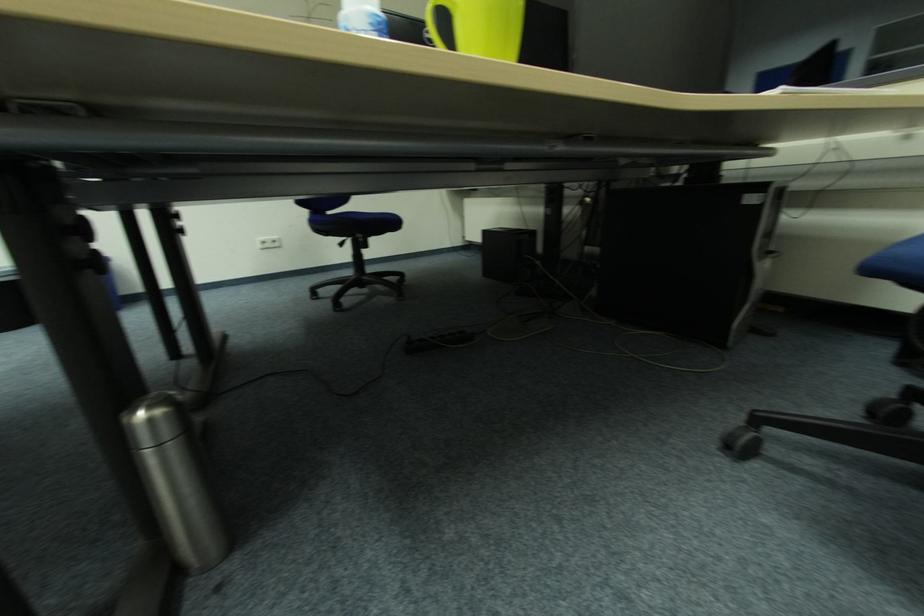
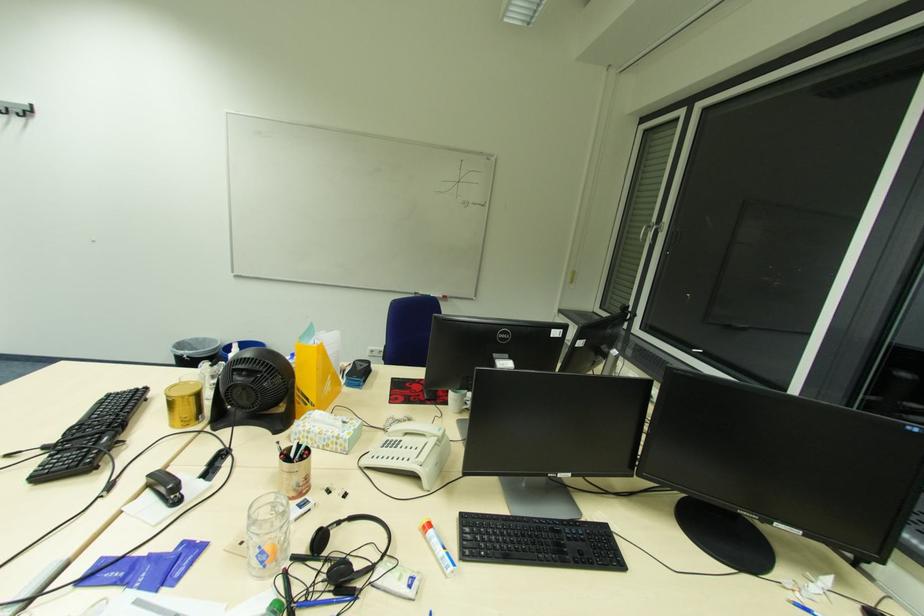
Question: The images are taken continuously from a first-person perspective. In which direction are you moving?

Choices:
 (A) Left
 (B) Right
 (C) Forward
 (D) Backward

Answer: (B)